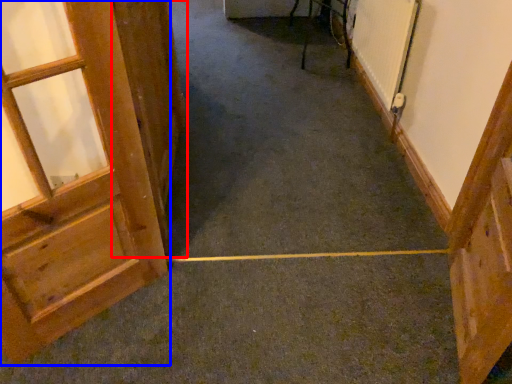
Question: Which of the following is the farthest to the observer, door (highlighted by a red box) or door (highlighted by a blue box)?

Choices:
 (A) door
 (B) door

Answer: (A)